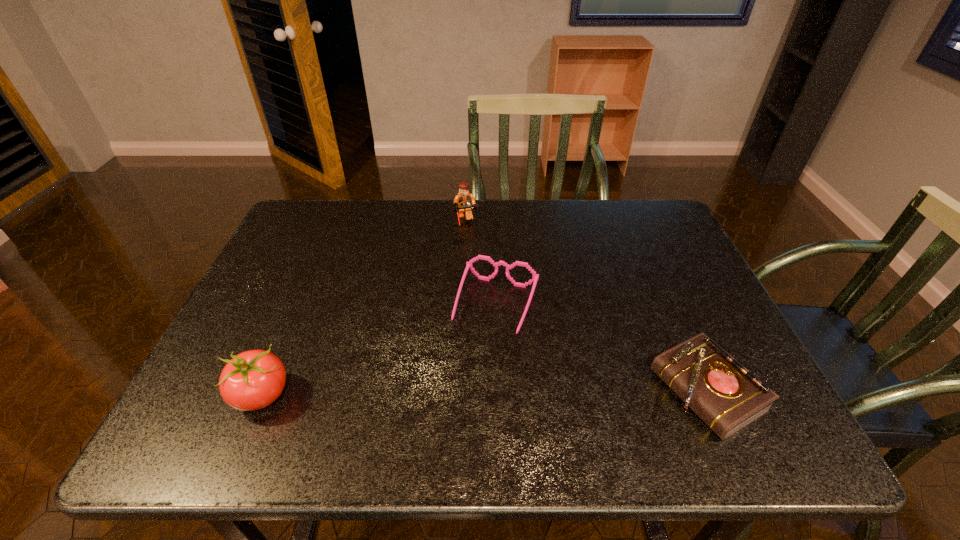
At what (x,y) coordinates should I click in order to perform the action: click on vacant space on the desktop that is between the leftmost object and the diary and is positioned holding a crossbow in the hands of the farthest object. Please return your answer as a coordinate pair (x, y). The image size is (960, 540). Looking at the image, I should click on (518, 393).

The width and height of the screenshot is (960, 540). Find the location of `vacant space on the desktop that is between the leftmost object and the rightmost object and is positioned on the arms of the third nearest object`. vacant space on the desktop that is between the leftmost object and the rightmost object and is positioned on the arms of the third nearest object is located at coordinates (466, 393).